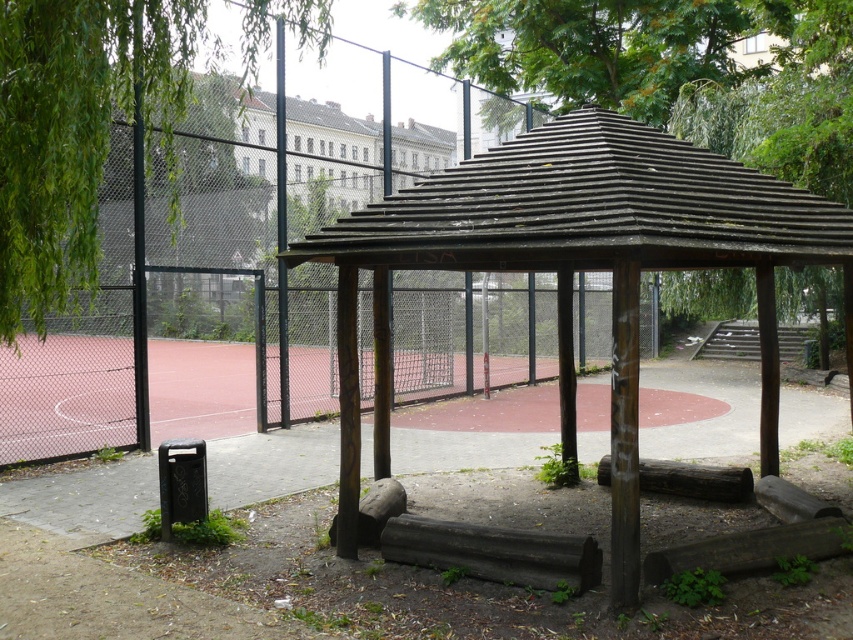
Can you confirm if weathered wood gazebo at center is taller than green leafy tree at left?

Yes.

Can you confirm if weathered wood gazebo at center is wider than green leafy tree at left?

Yes.

Is point (669, 157) more distant than point (122, 61)?

Yes, point (669, 157) is behind point (122, 61).

Locate an element on the screen. The width and height of the screenshot is (853, 640). weathered wood gazebo at center is located at coordinates (576, 259).